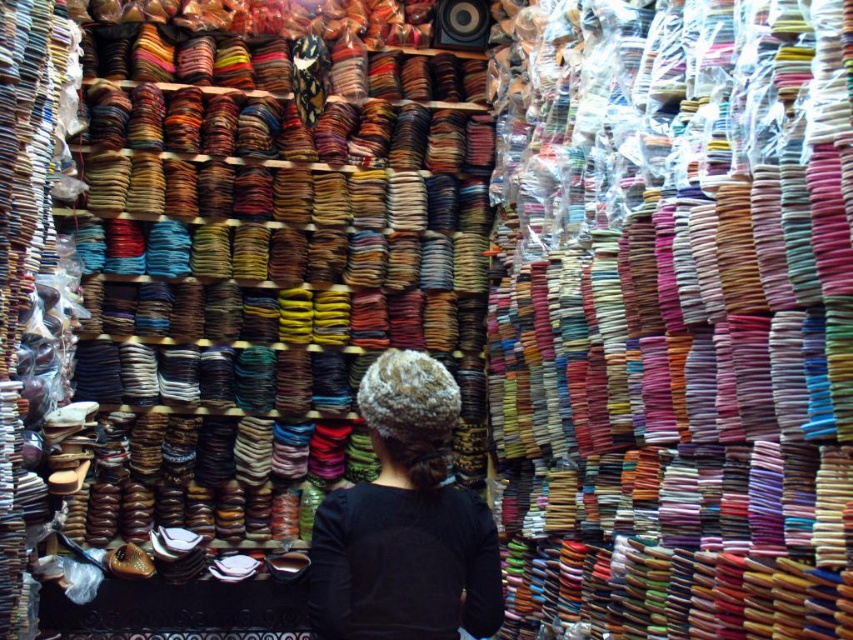
Question: Is shiny plastic bangles at center smaller than black matte hair at center?

Choices:
 (A) no
 (B) yes

Answer: (A)

Question: Which point is closer to the camera taking this photo?

Choices:
 (A) (494, 170)
 (B) (469, 596)

Answer: (B)

Question: Observing the image, what is the correct spatial positioning of shiny plastic bangles at center in reference to black matte hair at center?

Choices:
 (A) above
 (B) below

Answer: (A)

Question: Which of the following is the farthest from the observer?

Choices:
 (A) shiny plastic bangles at center
 (B) black matte hair at center

Answer: (B)

Question: Can you confirm if shiny plastic bangles at center is thinner than black matte hair at center?

Choices:
 (A) no
 (B) yes

Answer: (A)